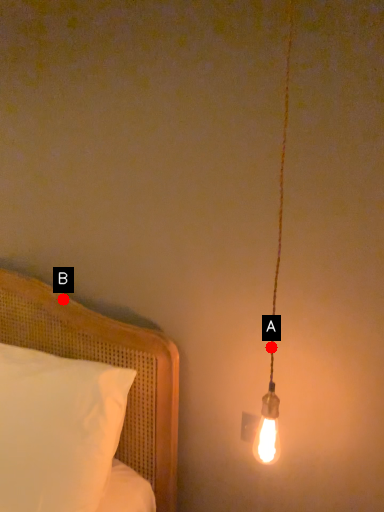
Question: Two points are circled on the image, labeled by A and B beside each circle. Among these points, which one is farthest from the camera?

Choices:
 (A) A is further
 (B) B is further

Answer: (B)